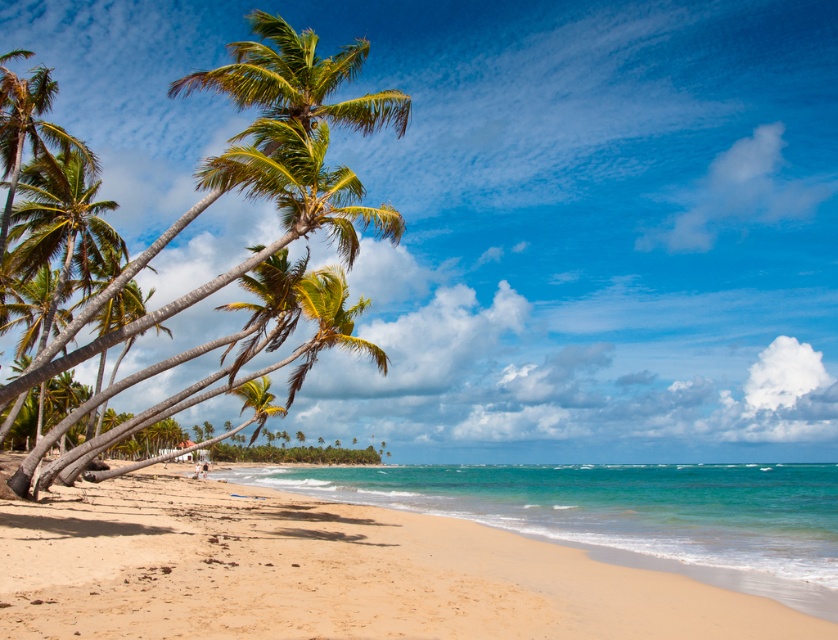
You are standing on the tropical beach and want to walk from your current position to the point marked as point (516, 573). There is an obstacle at point (270, 396). Will you encounter the obstacle before reaching your destination?

Point (516, 573) is in front of point (270, 396), so you will reach the destination before encountering the obstacle.

You are planning to set up a small tent on the sandy beach at lower left and the green leafy palm tree at center. Which location has enough space to accommodate the tent without needing to remove any natural features?

The sandy beach at lower left is bigger than the green leafy palm tree at center, so the sandy beach at lower left has enough space to accommodate the tent without needing to remove any natural features.